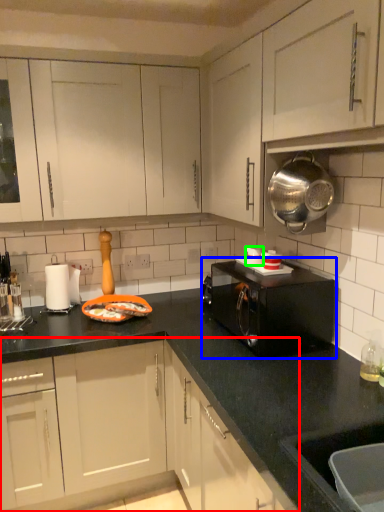
Question: Considering the real-world distances, which object is farthest from cabinetry (highlighted by a red box)? microwave oven (highlighted by a blue box) or appliance (highlighted by a green box)?

Choices:
 (A) microwave oven
 (B) appliance

Answer: (B)